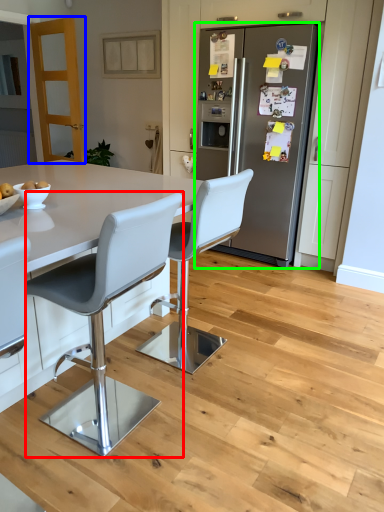
Question: Which object is the farthest from chair (highlighted by a red box)? Choose among these: glass door (highlighted by a blue box) or refrigerator (highlighted by a green box).

Choices:
 (A) glass door
 (B) refrigerator

Answer: (A)